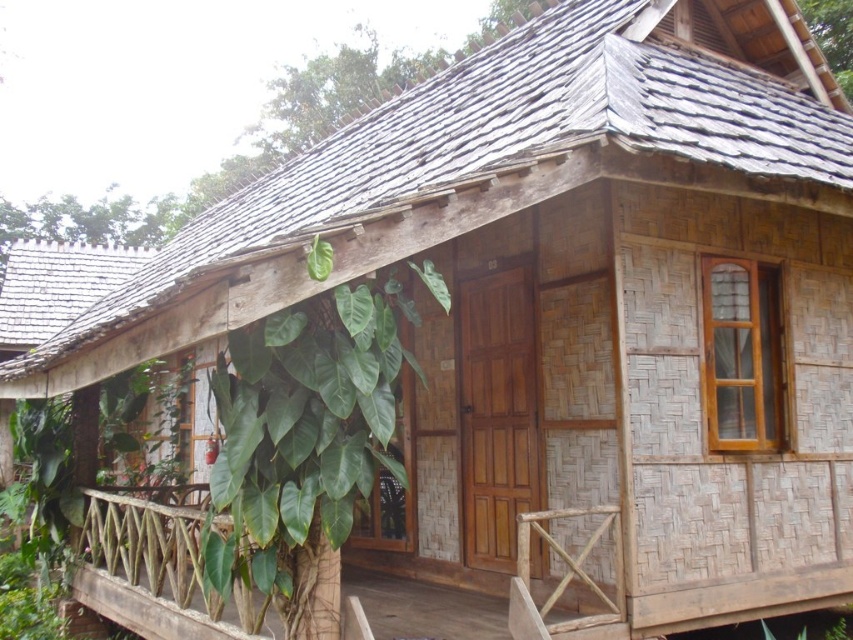
Question: Which point is farther to the camera?

Choices:
 (A) natural wood porch at center
 (B) green glossy leafy plant at center

Answer: (A)

Question: Is green glossy leafy plant at center smaller than natural wood porch at center?

Choices:
 (A) no
 (B) yes

Answer: (A)

Question: Can you confirm if green glossy leafy plant at center is positioned to the left of natural wood porch at center?

Choices:
 (A) no
 (B) yes

Answer: (B)

Question: Which object is farther from the camera taking this photo?

Choices:
 (A) natural wood porch at center
 (B) green glossy leafy plant at center

Answer: (A)

Question: Among these objects, which one is farthest from the camera?

Choices:
 (A) green glossy leafy plant at center
 (B) natural wood porch at center

Answer: (B)

Question: Does green glossy leafy plant at center appear on the right side of natural wood porch at center?

Choices:
 (A) no
 (B) yes

Answer: (A)